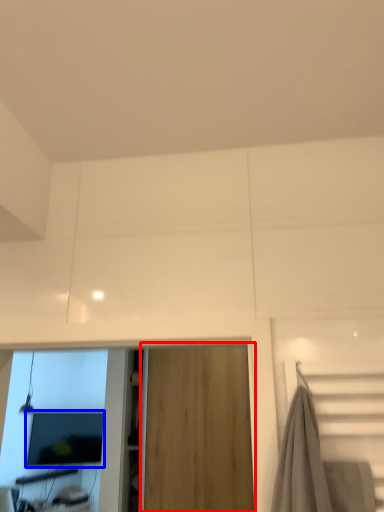
Question: Among these objects, which one is farthest to the camera, garage door (highlighted by a red box) or computer monitor (highlighted by a blue box)?

Choices:
 (A) garage door
 (B) computer monitor

Answer: (B)